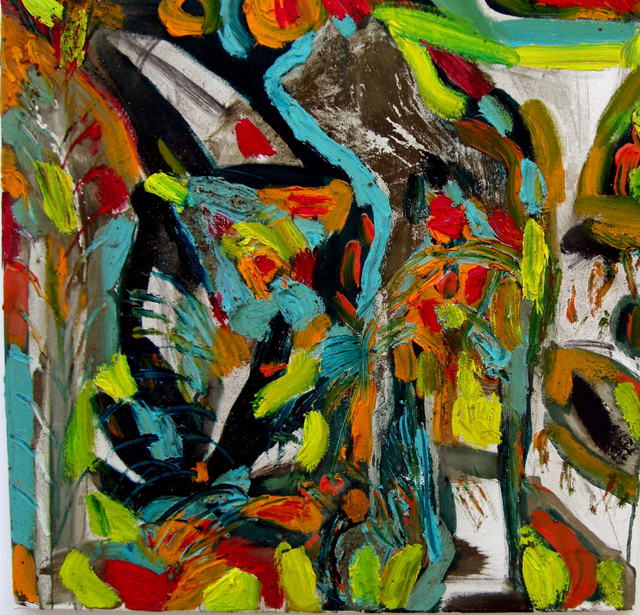
You are a GUI agent. You are given a task and a screenshot of the screen. Output one action in this format:
    pyautogui.click(x=<x>, y=<y>)
    Task: Click on the corners of painting
    This screenshot has width=640, height=615.
    Given the screenshot: What is the action you would take?
    636,612, 636,0, 4,2, 13,603